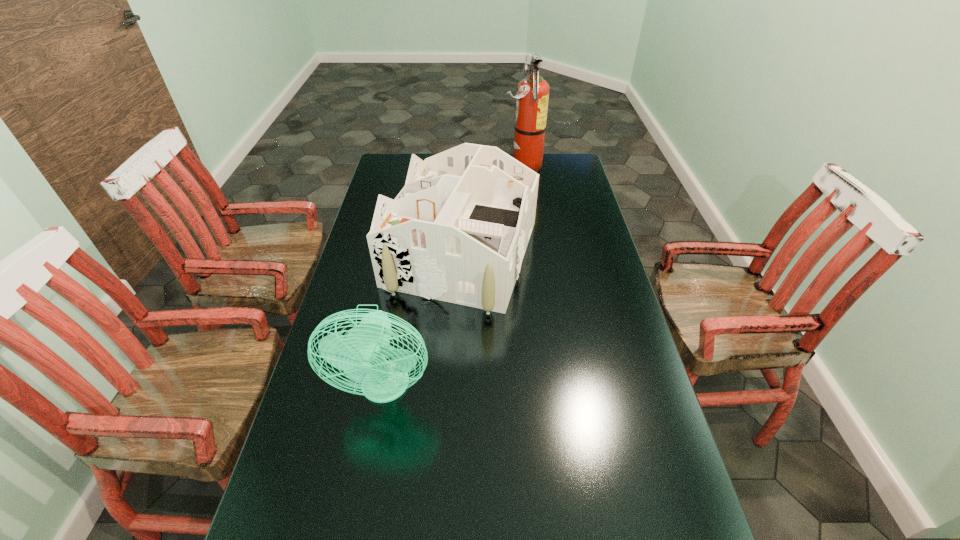
This screenshot has height=540, width=960. Find the location of `fire extinguisher`. fire extinguisher is located at coordinates (532, 95).

Find the location of a particular element. The width and height of the screenshot is (960, 540). the farthest object is located at coordinates (532, 95).

In order to click on fan in this screenshot , I will do `click(361, 355)`.

The image size is (960, 540). In order to click on dollhouse in this screenshot , I will do `click(457, 232)`.

You are a GUI agent. You are given a task and a screenshot of the screen. Output one action in this format:
    pyautogui.click(x=<x>, y=<y>)
    Task: Click on the free space located from the nozzle of the farthest object
    
    Given the screenshot: What is the action you would take?
    pyautogui.click(x=487, y=166)

Image resolution: width=960 pixels, height=540 pixels. In order to click on vacant position located 0.100m from the nozzle of the farthest object in this screenshot , I will do `click(480, 166)`.

Locate an element on the screen. Image resolution: width=960 pixels, height=540 pixels. free region located 0.400m from the nozzle of the farthest object is located at coordinates (414, 166).

This screenshot has height=540, width=960. In order to click on vacant space located 0.050m in front of the fan to blow air in this screenshot , I will do `click(375, 437)`.

The height and width of the screenshot is (540, 960). I want to click on vacant region located 0.340m on the back of the second farthest object, so click(x=467, y=164).

In order to click on object that is at the far edge in this screenshot , I will do `click(532, 95)`.